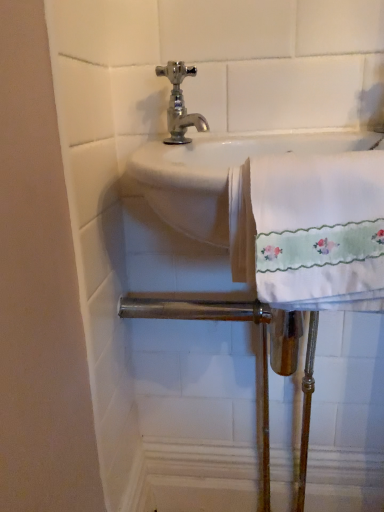
Question: Considering the positions of point (172, 124) and point (316, 179), is point (172, 124) closer or farther from the camera than point (316, 179)?

Choices:
 (A) closer
 (B) farther

Answer: (B)

Question: From their relative heights in the image, would you say chrome/metallic faucet at upper center is taller or shorter than white embroidered towel at right?

Choices:
 (A) tall
 (B) short

Answer: (B)

Question: Visually, is chrome/metallic faucet at upper center positioned to the left or to the right of white embroidered towel at right?

Choices:
 (A) right
 (B) left

Answer: (B)

Question: From the image's perspective, is white embroidered towel at right located above or below chrome/metallic faucet at upper center?

Choices:
 (A) below
 (B) above

Answer: (A)

Question: From a real-world perspective, is white embroidered towel at right physically located above or below chrome/metallic faucet at upper center?

Choices:
 (A) above
 (B) below

Answer: (B)

Question: Considering their positions, is white embroidered towel at right located in front of or behind chrome/metallic faucet at upper center?

Choices:
 (A) front
 (B) behind

Answer: (A)

Question: Is white embroidered towel at right spatially inside chrome/metallic faucet at upper center, or outside of it?

Choices:
 (A) outside
 (B) inside

Answer: (A)